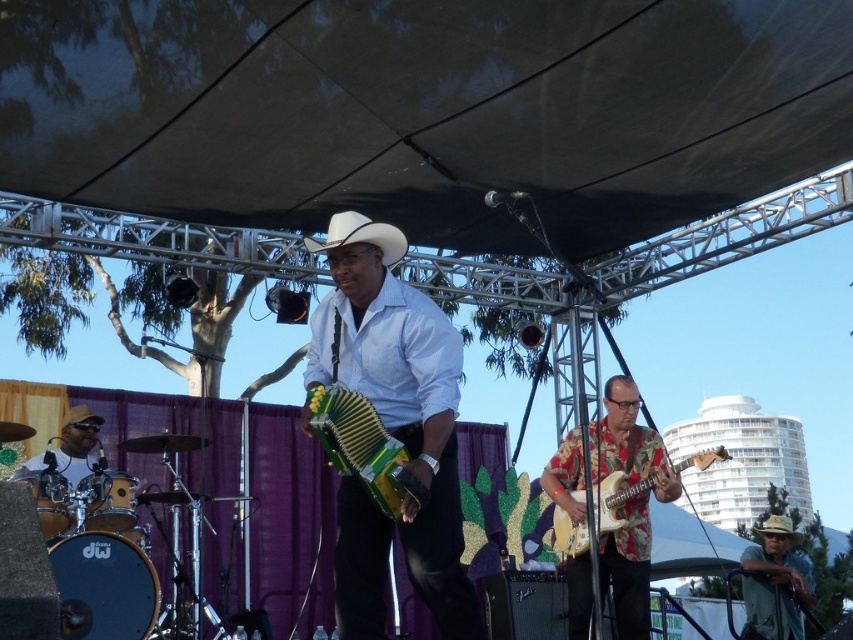
Does green matte accordion at center have a greater width compared to shiny gold drum set at lower left?

Indeed, green matte accordion at center has a greater width compared to shiny gold drum set at lower left.

Measure the distance between point (440, 394) and camera.

The distance of point (440, 394) from camera is 14.54 feet.

This screenshot has width=853, height=640. I want to click on green matte accordion at center, so click(399, 397).

Is floral fabric guitar at center bigger than shiny gold drum set at lower left?

Yes, floral fabric guitar at center is bigger than shiny gold drum set at lower left.

Can you confirm if floral fabric guitar at center is positioned below shiny gold drum set at lower left?

Yes.

Is point (573, 552) farther from viewer compared to point (32, 464)?

That is False.

Identify the location of floral fabric guitar at center. This screenshot has width=853, height=640. (614, 500).

Does green/yellow plastic accordion at center appear under white matte cowboy hat at center?

Correct, green/yellow plastic accordion at center is located below white matte cowboy hat at center.

Does green/yellow plastic accordion at center have a lesser height compared to white matte cowboy hat at center?

No, green/yellow plastic accordion at center is not shorter than white matte cowboy hat at center.

Who is more distant from viewer, (329, 436) or (392, 262)?

The point (392, 262) is behind.

Where is `green/yellow plastic accordion at center`? green/yellow plastic accordion at center is located at coordinates (363, 448).